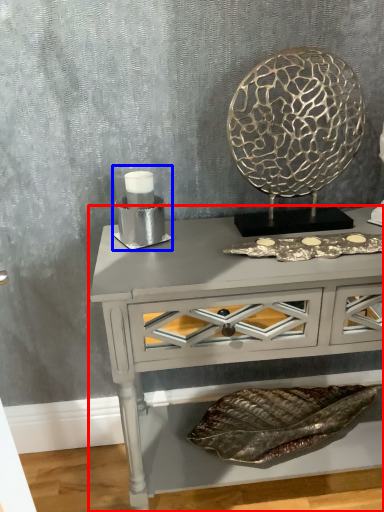
Question: Among these objects, which one is farthest to the camera, table (highlighted by a red box) or candle holder (highlighted by a blue box)?

Choices:
 (A) table
 (B) candle holder

Answer: (B)